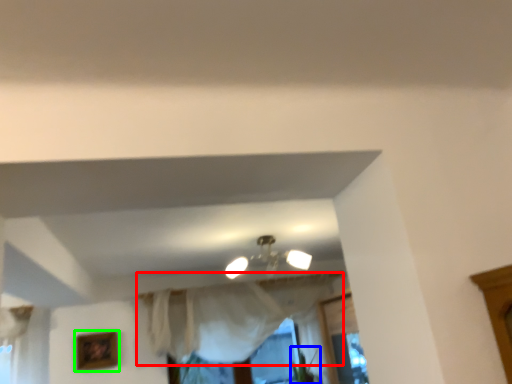
Question: Based on their relative distances, which object is farther from curtain (highlighted by a red box)? Choose from plant (highlighted by a blue box) and picture frame (highlighted by a green box).

Choices:
 (A) plant
 (B) picture frame

Answer: (B)